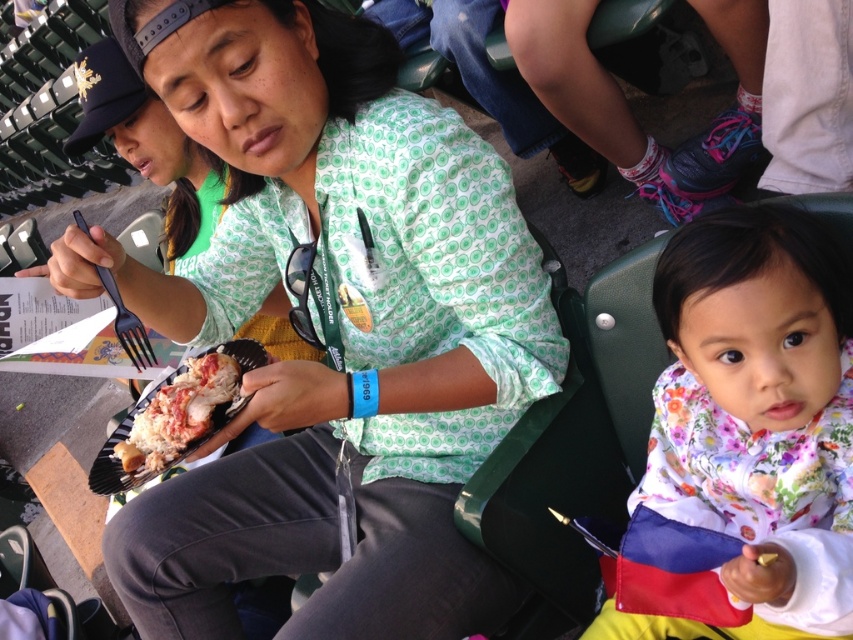
Between matte green shirt at center and black plastic fork at center, which one is positioned higher?

black plastic fork at center

Based on the photo, is matte green shirt at center below black plastic fork at center?

Yes.

Which is in front, point (322, 602) or point (134, 330)?

Positioned in front is point (134, 330).

The width and height of the screenshot is (853, 640). Identify the location of matte green shirt at center. (339, 326).

Can you confirm if floral fabric baby at center is positioned to the right of black plastic fork at center?

Indeed, floral fabric baby at center is positioned on the right side of black plastic fork at center.

Between floral fabric baby at center and black plastic fork at center, which one is positioned higher?

black plastic fork at center is higher up.

Is point (776, 257) positioned in front of point (85, 221)?

Yes, point (776, 257) is in front of point (85, 221).

Where is `floral fabric baby at center`? The height and width of the screenshot is (640, 853). floral fabric baby at center is located at coordinates (744, 440).

Is matte green shirt at center shorter than shiny lobster at center?

Incorrect, matte green shirt at center's height does not fall short of shiny lobster at center's.

In order to click on matte green shirt at center in this screenshot , I will do `click(339, 326)`.

Between point (368, 132) and point (202, 371), which one is positioned in front?

Positioned in front is point (202, 371).

This screenshot has width=853, height=640. Identify the location of matte green shirt at center. (339, 326).